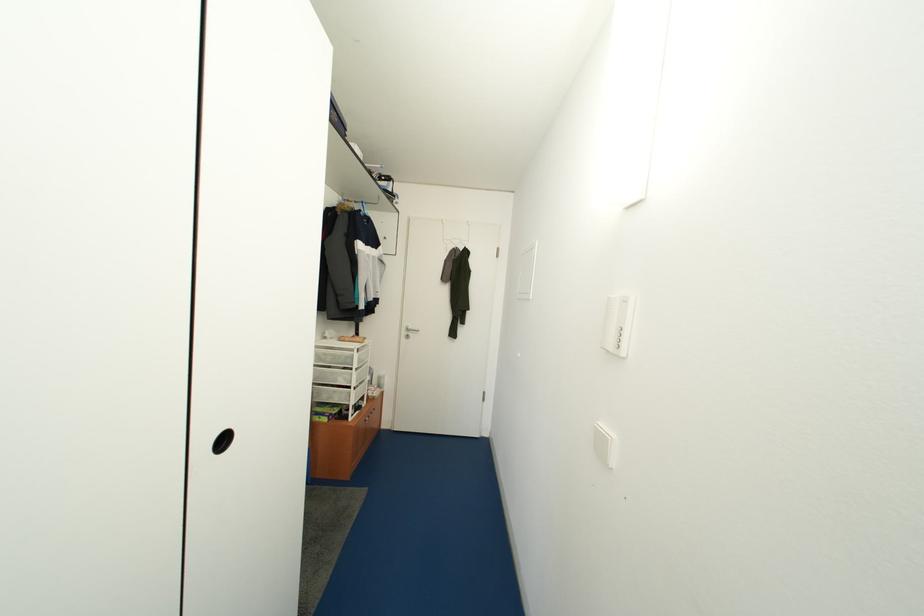
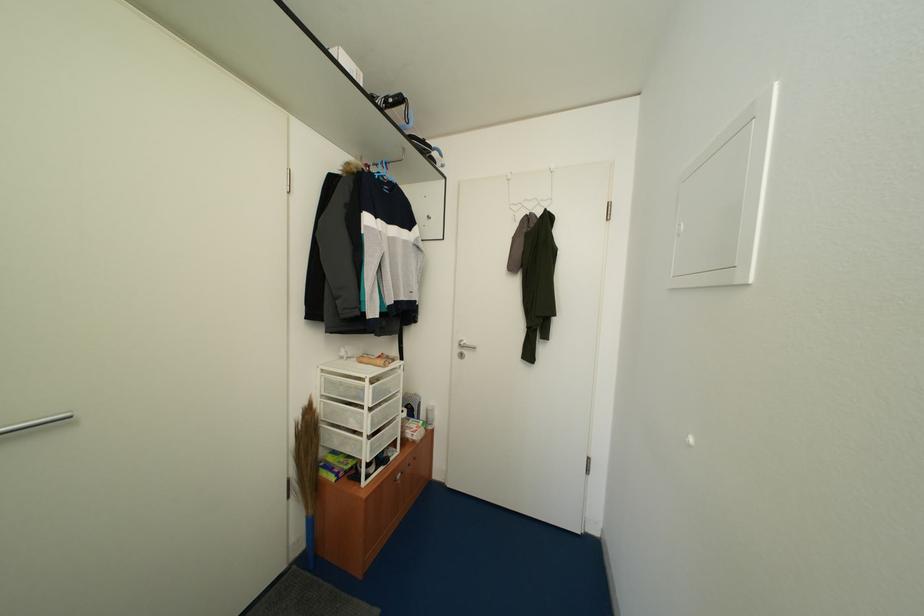
Question: How did the camera likely rotate?

Choices:
 (A) Left
 (B) Right
 (C) Up
 (D) Down

Answer: (A)